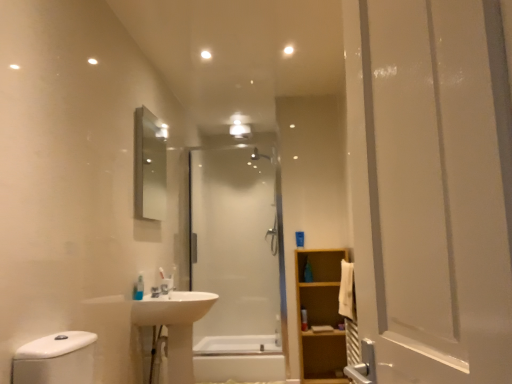
Question: From the image's perspective, is transparent glass shower at center located beneath silver metallic mirror at upper left?

Choices:
 (A) no
 (B) yes

Answer: (B)

Question: Can you confirm if transparent glass shower at center is smaller than silver metallic mirror at upper left?

Choices:
 (A) no
 (B) yes

Answer: (A)

Question: Does transparent glass shower at center have a greater width compared to silver metallic mirror at upper left?

Choices:
 (A) no
 (B) yes

Answer: (B)

Question: Is transparent glass shower at center positioned behind silver metallic mirror at upper left?

Choices:
 (A) no
 (B) yes

Answer: (B)

Question: Is transparent glass shower at center shorter than silver metallic mirror at upper left?

Choices:
 (A) no
 (B) yes

Answer: (A)

Question: Does transparent glass shower at center appear on the right side of silver metallic mirror at upper left?

Choices:
 (A) yes
 (B) no

Answer: (A)

Question: Is translucent plastic bottle at center, arranged as the 1th toiletry when ordered from the bottom, shorter than light brown wooden cabinet at right?

Choices:
 (A) yes
 (B) no

Answer: (A)

Question: From a real-world perspective, is translucent plastic bottle at center, the 1th toiletry in the right-to-left sequence, below light brown wooden cabinet at right?

Choices:
 (A) yes
 (B) no

Answer: (B)

Question: Is translucent plastic bottle at center, which is the second toiletry in front-to-back order, further to camera compared to light brown wooden cabinet at right?

Choices:
 (A) no
 (B) yes

Answer: (B)

Question: Can you confirm if translucent plastic bottle at center, which is the 2th toiletry in left-to-right order, is thinner than light brown wooden cabinet at right?

Choices:
 (A) yes
 (B) no

Answer: (A)

Question: Is light brown wooden cabinet at right at the back of translucent plastic bottle at center, which is the 2th toiletry in left-to-right order?

Choices:
 (A) no
 (B) yes

Answer: (B)

Question: Does translucent plastic bottle at center, which is the 2th toiletry in left-to-right order, touch light brown wooden cabinet at right?

Choices:
 (A) no
 (B) yes

Answer: (A)

Question: Is white glossy sink at lower center turned away from light brown wooden cabinet at right?

Choices:
 (A) yes
 (B) no

Answer: (B)